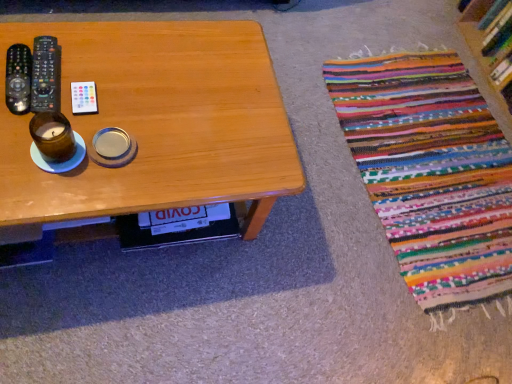
Locate an element on the screen. This screenshot has width=512, height=384. free area in between wooden bookshelf at upper right and wooden table at center is located at coordinates (386, 108).